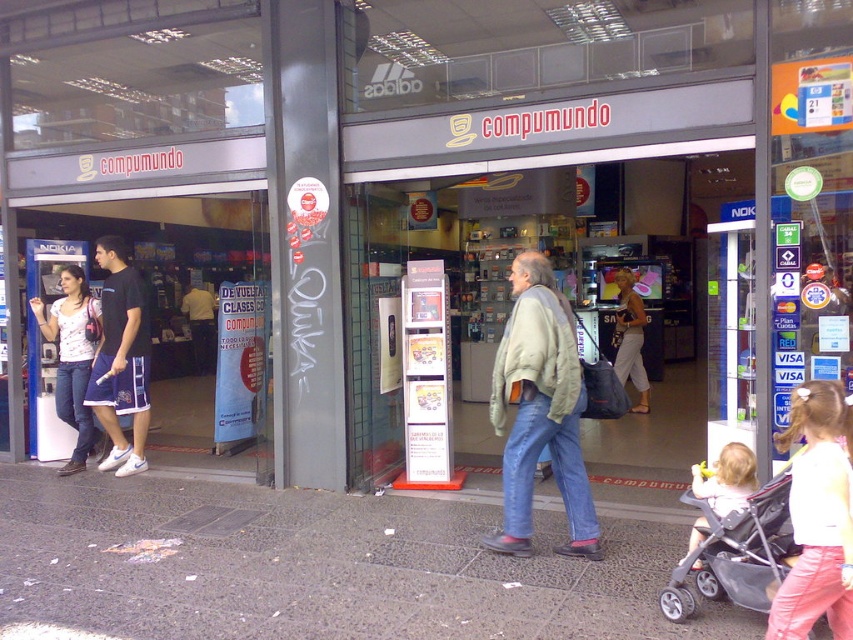
Question: Considering the real-world distances, which object is closest to the matte beige pants at center?

Choices:
 (A) light gray woolen jacket at center
 (B) yellow shirt at center
 (C) gray fabric stroller at lower right

Answer: (A)

Question: Does light pink fabric baby carriage at lower right appear on the left side of yellow shirt at center?

Choices:
 (A) yes
 (B) no

Answer: (B)

Question: Which point is farther to the camera?

Choices:
 (A) (531, 577)
 (B) (711, 589)

Answer: (A)

Question: Among these points, which one is farthest from the camera?

Choices:
 (A) (804, 387)
 (B) (508, 497)

Answer: (B)

Question: Does white printed t-shirt at left appear on the left side of matte beige pants at center?

Choices:
 (A) yes
 (B) no

Answer: (A)

Question: Does matte black shorts at left appear under yellow shirt at center?

Choices:
 (A) no
 (B) yes

Answer: (B)